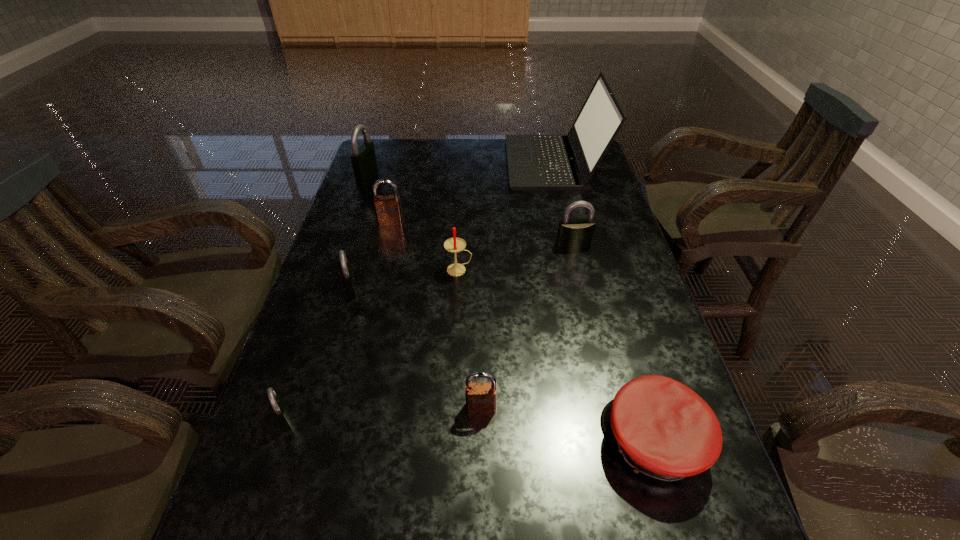
The width and height of the screenshot is (960, 540). What are the coordinates of `padlock that is the second nearest to the sixth farthest object` in the screenshot? It's located at (x=280, y=411).

Where is `the fifth closest padlock to the second padlock from right to left`? the fifth closest padlock to the second padlock from right to left is located at coordinates (364, 162).

Select which black padlock appears as the closest to the shortest padlock. Please provide its 2D coordinates. Your answer should be formatted as a tuple, i.e. [(x, y)], where the tuple contains the x and y coordinates of a point satisfying the conditions above.

[(346, 271)]

Choose which black padlock is the second nearest neighbor to the third padlock from right to left. Please provide its 2D coordinates. Your answer should be formatted as a tuple, i.e. [(x, y)], where the tuple contains the x and y coordinates of a point satisfying the conditions above.

[(346, 271)]

Point out which brown padlock is positioned as the nearest to the fifth farthest object. Please provide its 2D coordinates. Your answer should be formatted as a tuple, i.e. [(x, y)], where the tuple contains the x and y coordinates of a point satisfying the conditions above.

[(388, 210)]

Identify which brown padlock is the second closest to the fourth padlock from right to left. Please provide its 2D coordinates. Your answer should be formatted as a tuple, i.e. [(x, y)], where the tuple contains the x and y coordinates of a point satisfying the conditions above.

[(480, 397)]

Locate an element on the screen. The height and width of the screenshot is (540, 960). vacant area that satisfies the following two spatial constraints: 1. on the back side of the third biggest black padlock; 2. on the left side of the fifth farthest object is located at coordinates (357, 270).

Where is `free space in the image that satisfies the following two spatial constraints: 1. on the front-facing side of the bigger brown padlock; 2. on the left side of the rightmost padlock`? This screenshot has height=540, width=960. free space in the image that satisfies the following two spatial constraints: 1. on the front-facing side of the bigger brown padlock; 2. on the left side of the rightmost padlock is located at coordinates (385, 245).

Find the location of `free space that satisfies the following two spatial constraints: 1. on the surface of the gray laptop; 2. on the front-facing side of the smaller brown padlock`. free space that satisfies the following two spatial constraints: 1. on the surface of the gray laptop; 2. on the front-facing side of the smaller brown padlock is located at coordinates (611, 407).